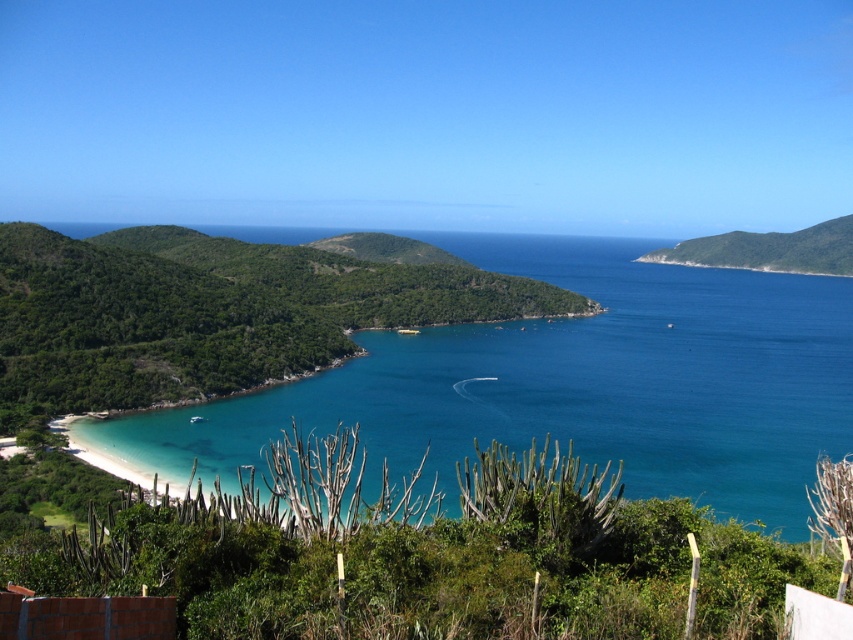
Based on the photo, is clear blue water at lower left wider than green leafy hill at upper right?

Yes.

Is point (668, 440) positioned in front of point (751, 241)?

Yes, point (668, 440) is closer to viewer.

Is point (149, 442) farther from camera compared to point (796, 252)?

No, (149, 442) is in front of (796, 252).

Where is `clear blue water at lower left`? clear blue water at lower left is located at coordinates (572, 384).

Does clear blue water at lower left have a greater height compared to green leafy hill at lower left?

Yes.

Which is in front, point (489, 326) or point (154, 401)?

Point (154, 401) is more forward.

Image resolution: width=853 pixels, height=640 pixels. What are the coordinates of `clear blue water at lower left` in the screenshot? It's located at (572, 384).

Who is more distant from viewer, [154,342] or [753,232]?

The point [753,232] is more distant.

Find the location of a particular element. green leafy hill at lower left is located at coordinates (209, 314).